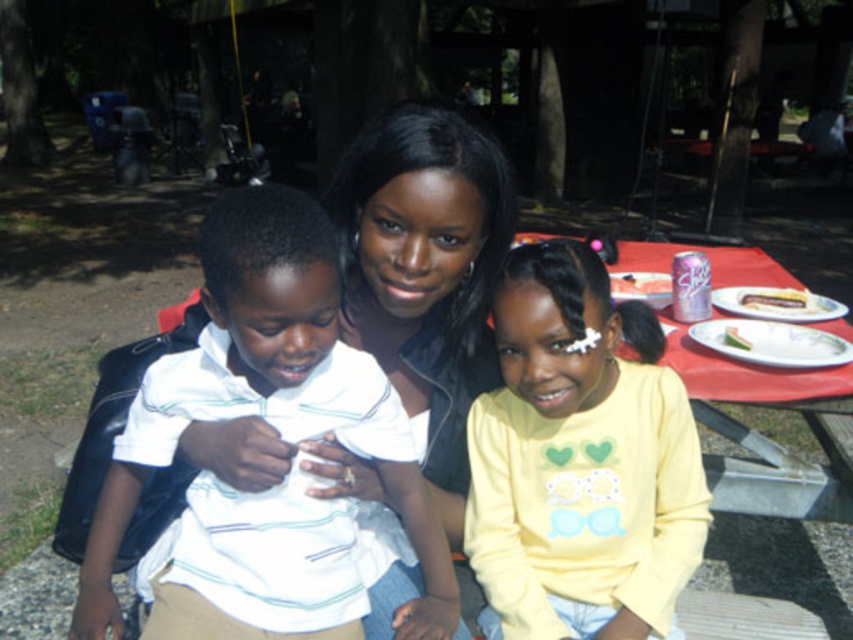
Which is above, white striped shirt at center or white paper plate at center right?

white paper plate at center right is higher up.

Does white striped shirt at center have a greater width compared to white paper plate at center right?

Yes.

Between point (271, 388) and point (775, 288), which one is positioned in front?

Point (271, 388) is in front.

You are a GUI agent. You are given a task and a screenshot of the screen. Output one action in this format:
    pyautogui.click(x=<x>, y=<y>)
    Task: Click on the white striped shirt at center
    The height and width of the screenshot is (640, 853).
    Given the screenshot: What is the action you would take?
    pyautogui.click(x=268, y=392)

Is white porcelain plate at right closer to camera compared to white paper plate at center right?

Yes, it is in front of white paper plate at center right.

In the scene shown: Who is positioned more to the left, white porcelain plate at right or white paper plate at center right?

Positioned to the left is white porcelain plate at right.

Locate an element on the screen. The width and height of the screenshot is (853, 640). white porcelain plate at right is located at coordinates (770, 342).

You are a GUI agent. You are given a task and a screenshot of the screen. Output one action in this format:
    pyautogui.click(x=<x>, y=<y>)
    Task: Click on the yellow matte shirt at center
    
    Given the screenshot: What is the action you would take?
    [x=578, y=465]

Who is higher up, yellow matte shirt at center or white paper plate at center right?

white paper plate at center right is above.

Where is `yellow matte shirt at center`? yellow matte shirt at center is located at coordinates (578, 465).